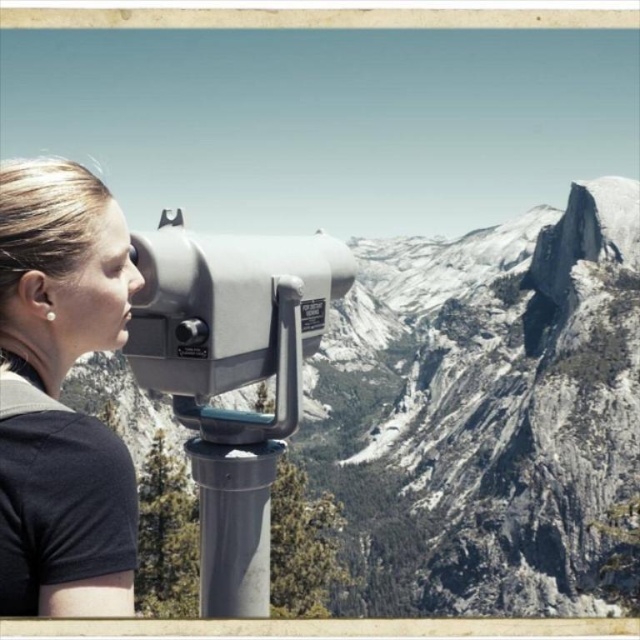
You are a hiker trying to decide whether to carry a 15 kg backpack up the mountain trail. You see the granite rock formation at center and the metallic gray telescope at center in the distance. Based on their sizes, which object would you estimate is closer to you?

The granite rock formation at center is larger in size compared to the metallic gray telescope at center, so it is likely closer to you since larger objects in the foreground appear bigger than distant ones.